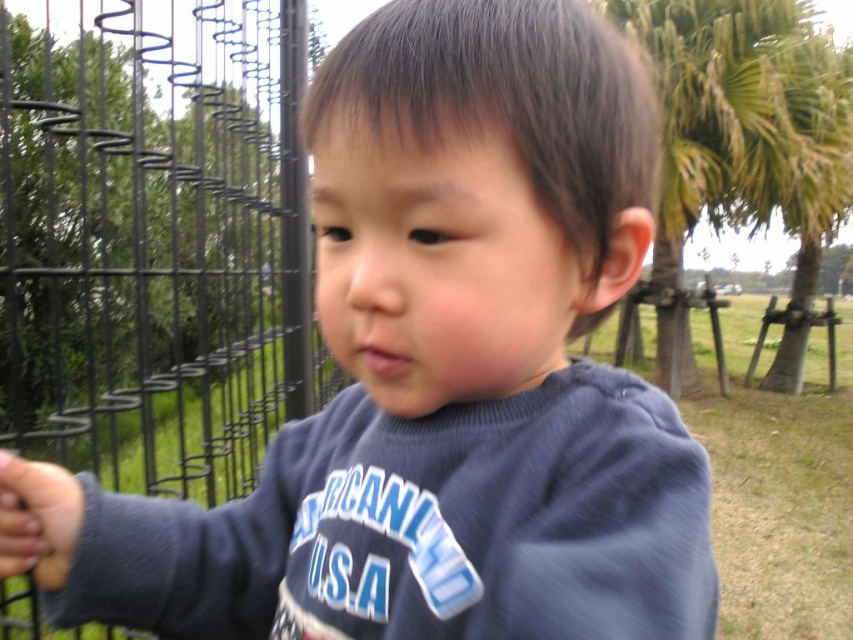
You are a photographer trying to capture a photo of the green leafy palm tree at upper right without the black wire fence at left obstructing the view. Based on the scene, can you position yourself in a way to avoid the fence blocking the palm tree?

The black wire fence at left is in front of the green leafy palm tree at upper right, so moving to the right side of the current position would place the fence between you and the palm tree. To avoid the obstruction, you should move to the left side so the palm tree is behind the fence, but this might not be ideal. Alternatively, moving further back might allow the fence and palm tree to align vertically, but since the fence is closer, adjusting the angle or moving around to the other side of the fence may

You are a photographer trying to capture a photo of the black wire fence at left and the green leafy palm tree at upper right in the same frame. If your camera has a maximum focus range of 6 meters, will both objects be in focus at the same time?

The black wire fence at left and green leafy palm tree at upper right are 5.91 meters apart from each other. Since the distance between them is within the camera maximum focus range of 6 meters, both objects will be in focus at the same time.